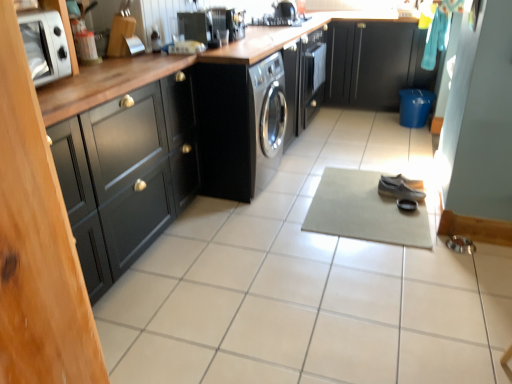
Question: From the image's perspective, relative to black matte cabinet at left, positioned as the 1th cabinetry in front-to-back order, is black glossy stove at upper center above or below?

Choices:
 (A) above
 (B) below

Answer: (A)

Question: Does point (282, 19) appear closer or farther from the camera than point (179, 205)?

Choices:
 (A) closer
 (B) farther

Answer: (B)

Question: Which object is the closest to the black matte cabinet at upper right, which is counted as the 2th cabinetry, starting from the left?

Choices:
 (A) black glossy stove at upper center
 (B) satin black washing machine at center
 (C) black matte cabinet at left, which is counted as the first cabinetry, starting from the left
 (D) silver metallic microwave at upper left
 (E) beige fabric yoga mat at center

Answer: (A)

Question: Estimate the real-world distances between objects in this image. Which object is closer to the white ceramic tile at center?

Choices:
 (A) black matte cabinet at upper right, which is counted as the 2th cabinetry, starting from the left
 (B) leather shoe at center, arranged as the first shoe when viewed from the front
 (C) black matte cabinet at left, positioned as the 1th cabinetry in front-to-back order
 (D) satin black coffee maker at upper center
 (E) satin black washing machine at center

Answer: (C)